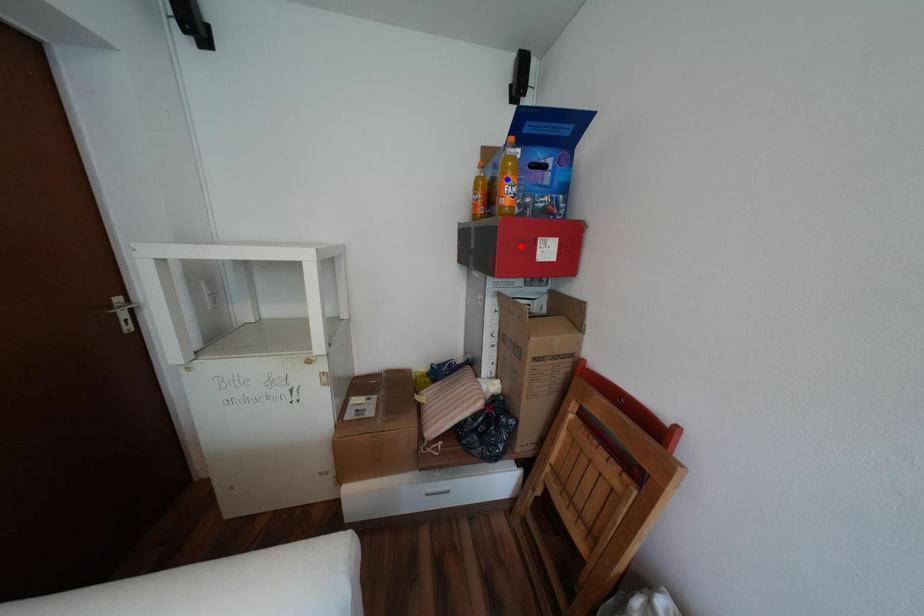
Question: Which of the two points in the image is closer to the camera?

Choices:
 (A) Blue point is closer.
 (B) Red point is closer.

Answer: (A)